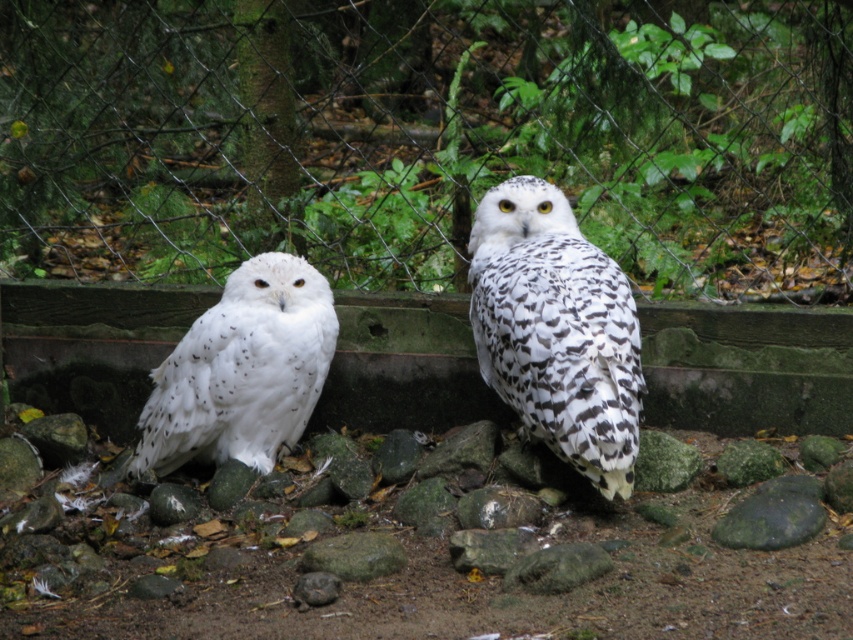
Question: Which point appears closest to the camera in this image?

Choices:
 (A) (374, 536)
 (B) (767, 228)

Answer: (A)

Question: Is white speckled owl at left positioned in front of gray rough rock at center?

Choices:
 (A) yes
 (B) no

Answer: (B)

Question: Which of the following is the farthest from the observer?

Choices:
 (A) (16, 266)
 (B) (294, 305)
 (C) (621, 314)

Answer: (A)

Question: Does wire mesh fence at center have a larger size compared to white speckled owl at left?

Choices:
 (A) yes
 (B) no

Answer: (A)

Question: Which is farther from the wire mesh fence at center?

Choices:
 (A) gray rough rock at center
 (B) speckled white owl at center
 (C) white speckled owl at left

Answer: (A)

Question: Does wire mesh fence at center have a greater width compared to white speckled owl at left?

Choices:
 (A) no
 (B) yes

Answer: (B)